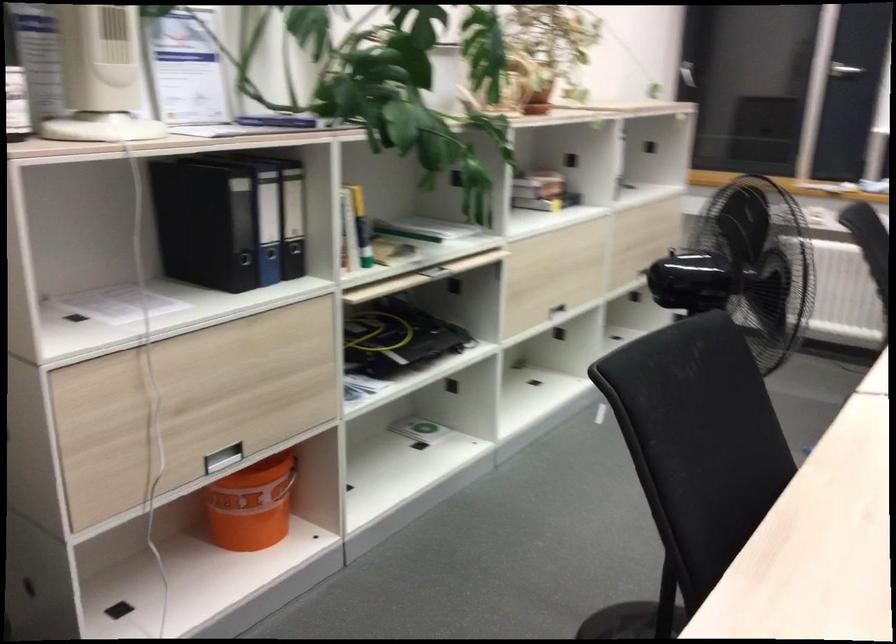
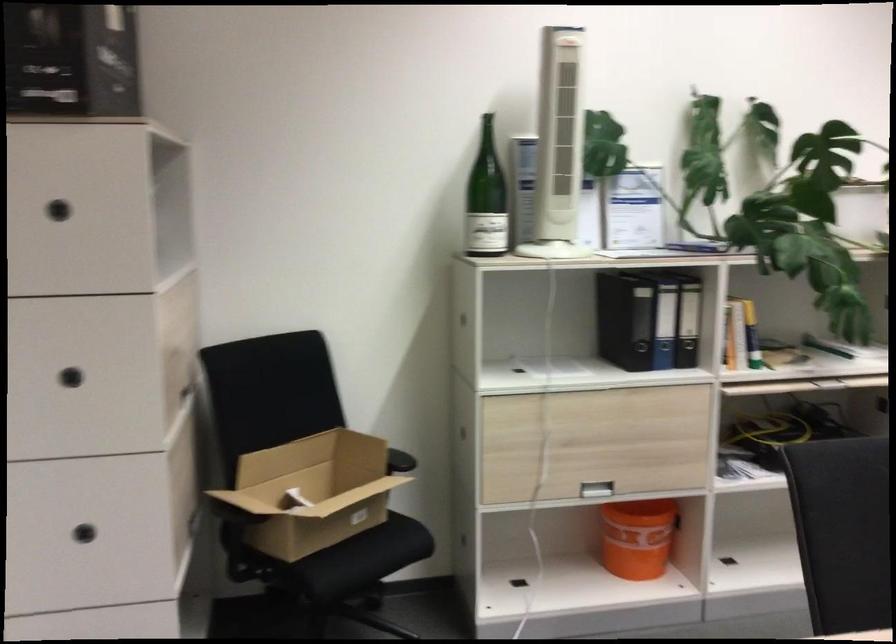
Find the pixel in the second image that matches pixel 268 227 in the first image.

(664, 325)